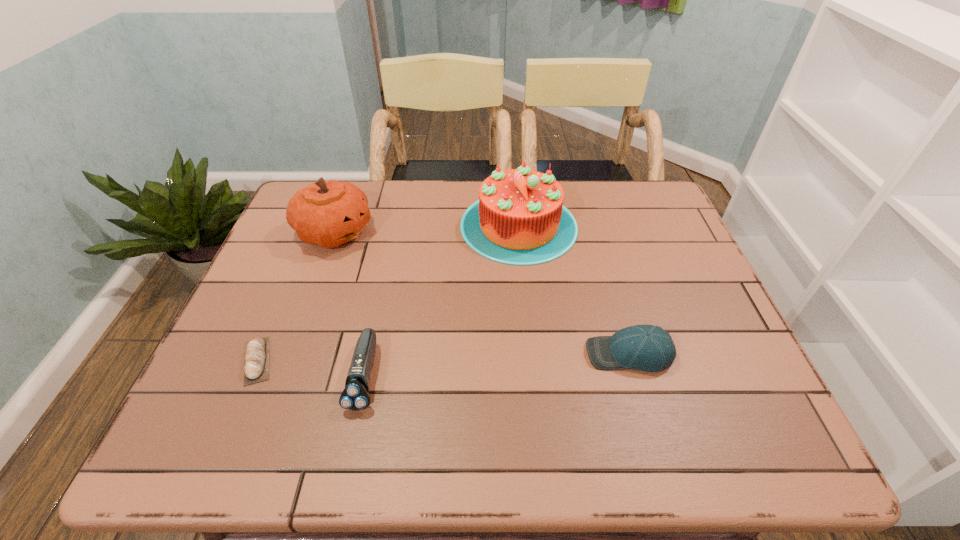
Find the location of a particular element. Image resolution: width=960 pixels, height=540 pixels. cake is located at coordinates (519, 219).

I want to click on pumpkin, so click(x=329, y=213).

Where is `baseball cap`? baseball cap is located at coordinates point(650,348).

Identify the location of electric shaver. (355, 396).

Find the location of `the shortest object`. the shortest object is located at coordinates click(x=256, y=367).

The image size is (960, 540). I want to click on vacant area situated 0.180m on the front of the cake, so click(528, 318).

Locate an element on the screen. free space located 0.340m on the front-facing side of the pumpkin is located at coordinates (492, 232).

Find the location of a particular element. Image resolution: width=960 pixels, height=540 pixels. vacant space located 0.160m on the front of the baseball cap is located at coordinates (657, 448).

What are the coordinates of `free space located 0.190m on the back of the shortest object` in the screenshot? It's located at click(292, 278).

This screenshot has width=960, height=540. In order to click on cake present at the far edge in this screenshot , I will do `click(519, 219)`.